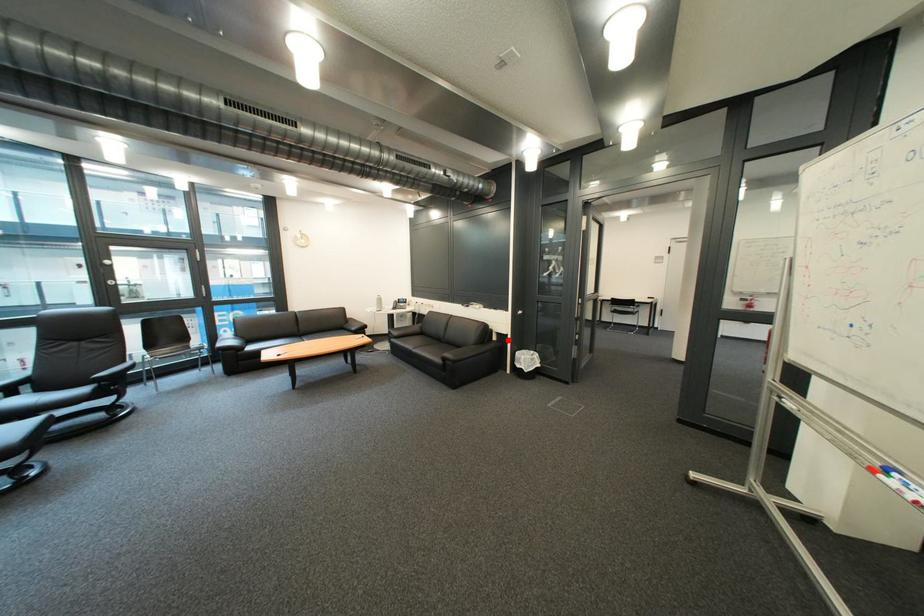
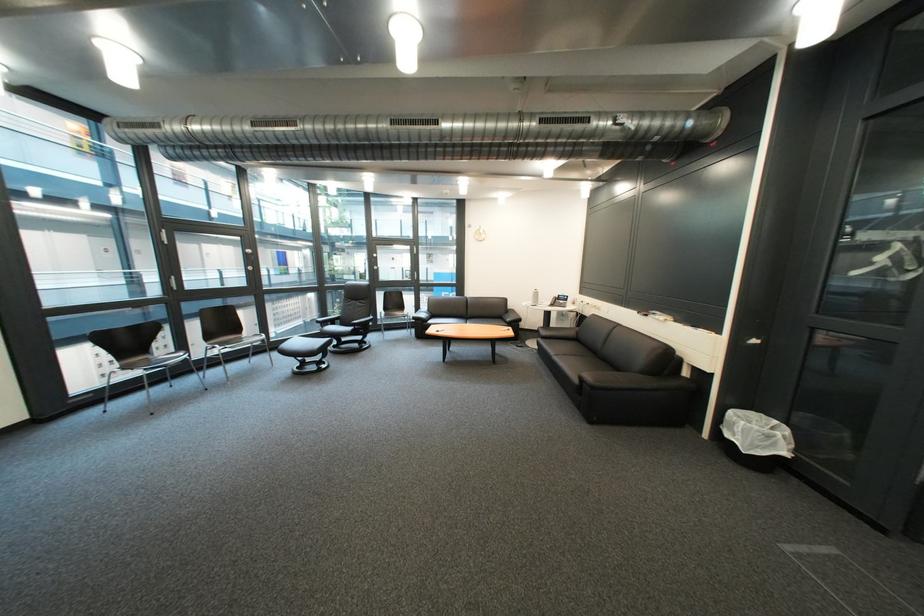
The point at the highlighted location is marked in the first image. Where is the corresponding point in the second image?

(699, 375)